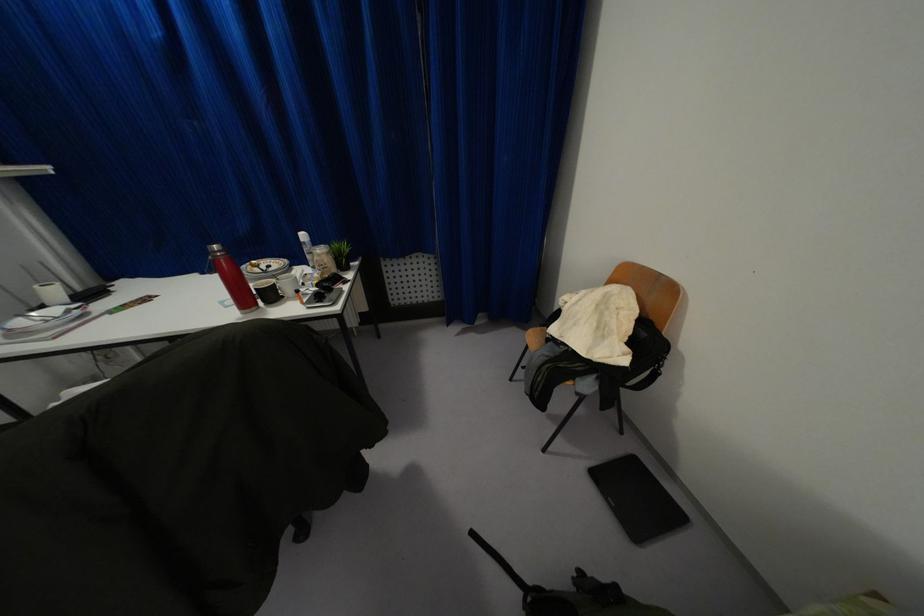
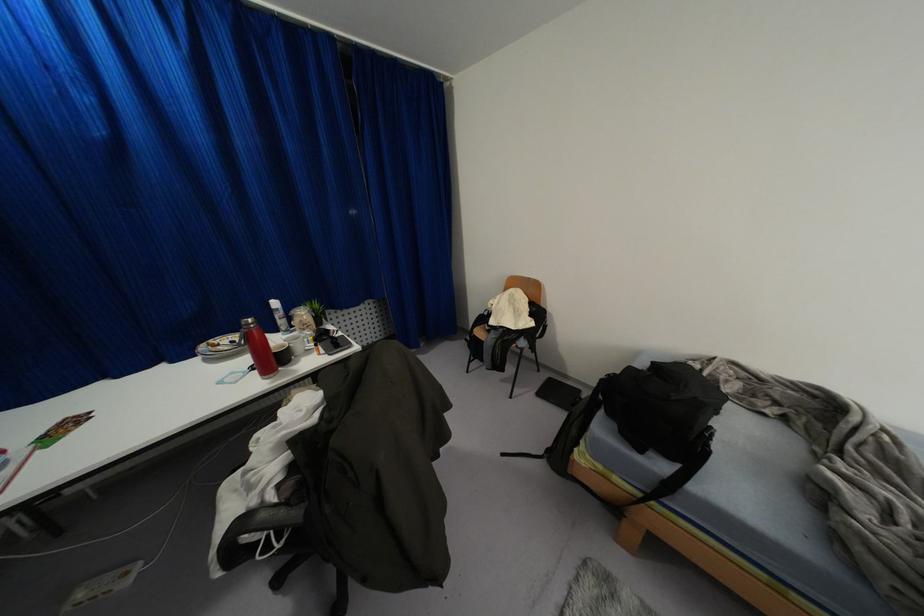
Question: The camera is either moving clockwise (left) or counter-clockwise (right) around the object. The first image is from the beginning of the video and the second image is from the end. Is the camera moving left or right when shooting the video?

Choices:
 (A) Left
 (B) Right

Answer: (A)